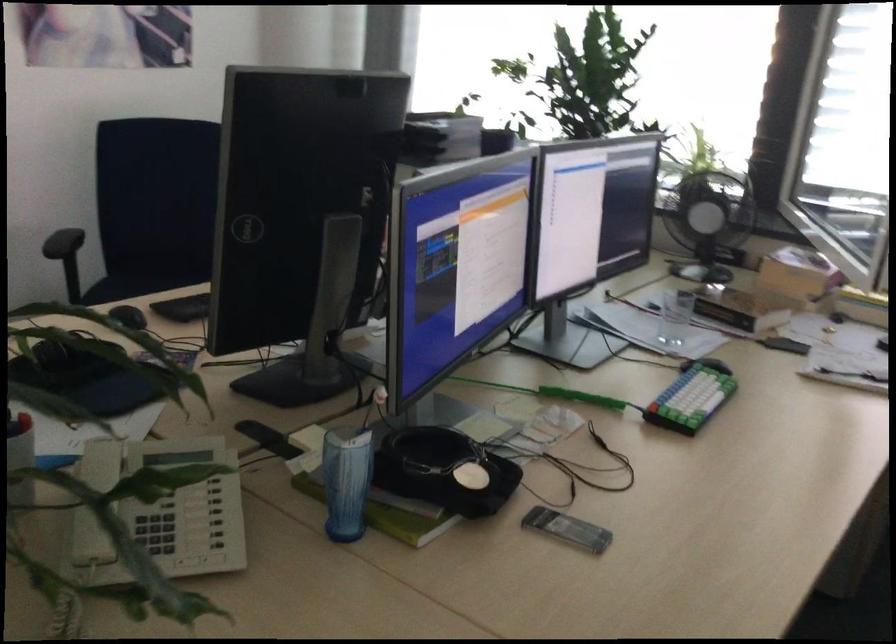
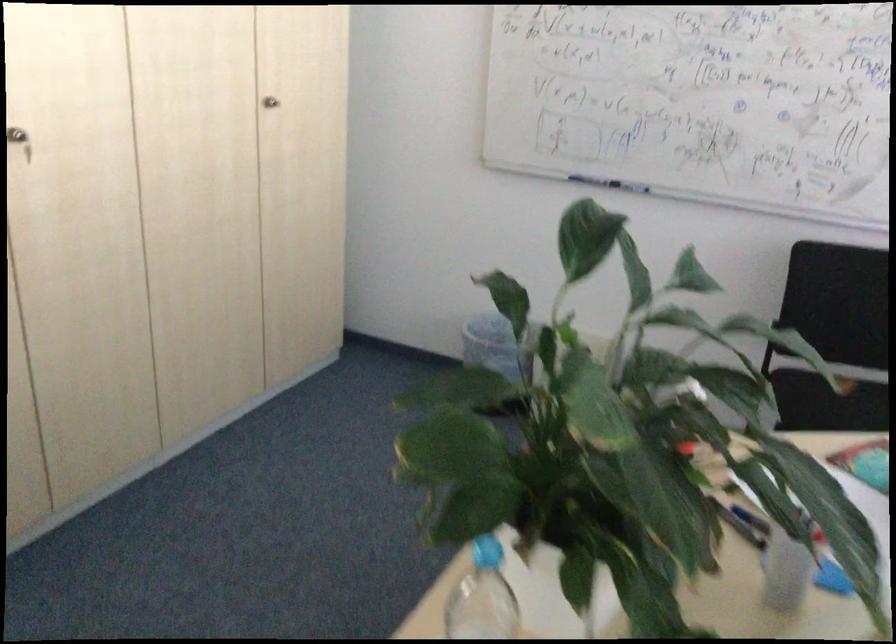
Question: The camera is either moving clockwise (left) or counter-clockwise (right) around the object. The first image is from the beginning of the video and the second image is from the end. Is the camera moving left or right when shooting the video?

Choices:
 (A) Left
 (B) Right

Answer: (B)